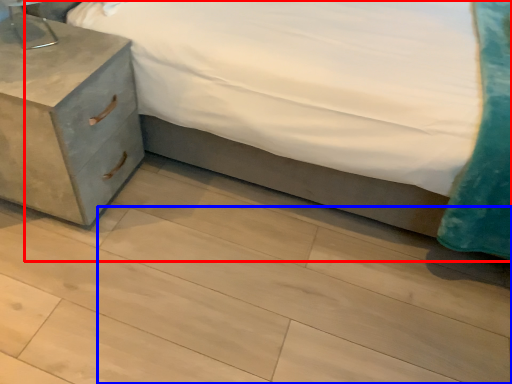
Question: Which object is further to the camera taking this photo, bed (highlighted by a red box) or tile (highlighted by a blue box)?

Choices:
 (A) bed
 (B) tile

Answer: (B)